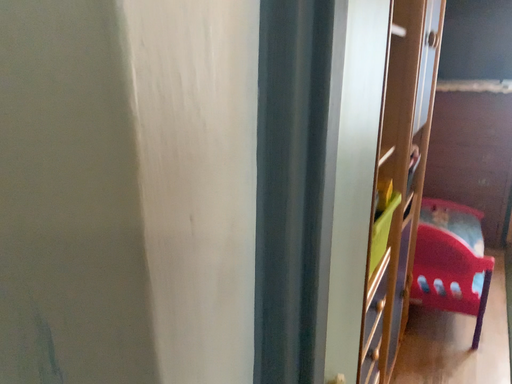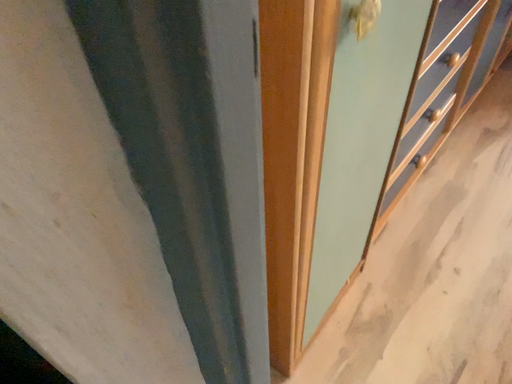
Question: Which way did the camera rotate in the video?

Choices:
 (A) rotated right
 (B) rotated left

Answer: (B)